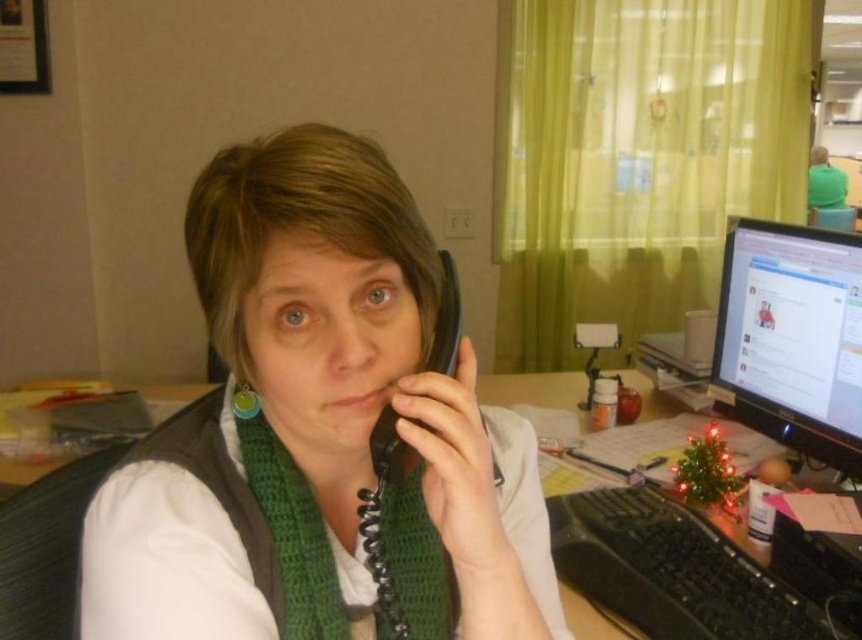
Question: Estimate the real-world distances between objects in this image. Which object is farther from the green knitted scarf at center?

Choices:
 (A) black glossy monitor at right
 (B) black plastic keyboard at center

Answer: (A)

Question: Is white matte vest at center positioned behind black rubberized phone at center?

Choices:
 (A) no
 (B) yes

Answer: (A)

Question: Does black glossy monitor at right have a greater width compared to green knitted scarf at center?

Choices:
 (A) no
 (B) yes

Answer: (A)

Question: Which point appears closest to the camera in this image?

Choices:
 (A) (807, 228)
 (B) (405, 595)

Answer: (B)

Question: Does white matte vest at center appear on the left side of black rubberized phone at center?

Choices:
 (A) no
 (B) yes

Answer: (B)

Question: Among these points, which one is nearest to the camera?

Choices:
 (A) (440, 598)
 (B) (791, 291)
 (C) (161, 486)
 (D) (494, 378)

Answer: (C)